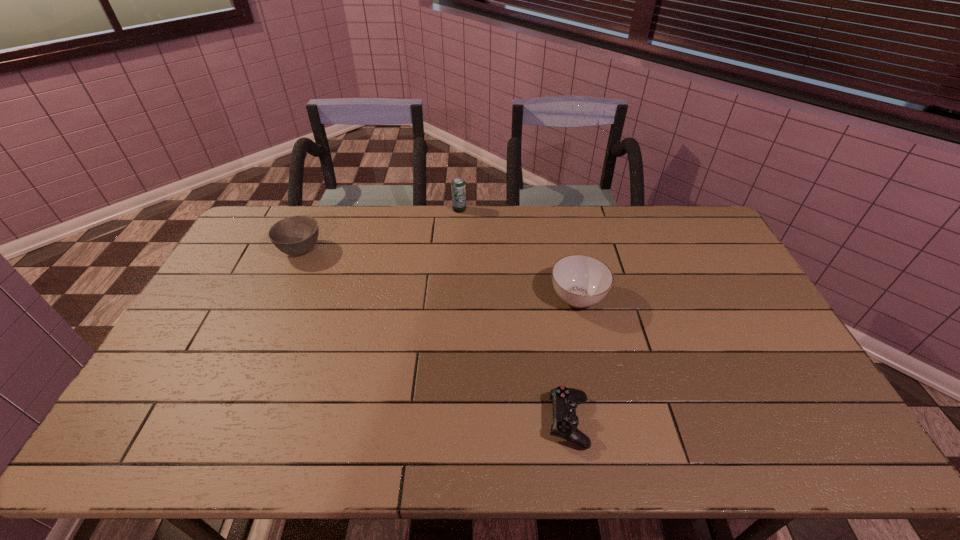
This screenshot has height=540, width=960. In order to click on the farthest object in this screenshot , I will do `click(458, 187)`.

This screenshot has width=960, height=540. I want to click on beer can, so click(x=458, y=187).

Where is `the third farthest object`? The height and width of the screenshot is (540, 960). the third farthest object is located at coordinates (581, 281).

You are a GUI agent. You are given a task and a screenshot of the screen. Output one action in this format:
    pyautogui.click(x=<x>, y=<y>)
    Task: Click on the third nearest object
    
    Given the screenshot: What is the action you would take?
    pyautogui.click(x=296, y=235)

Identify the location of the leftmost object. (296, 235).

At what (x,y) coordinates should I click in order to perform the action: click on control. Please return your answer as a coordinate pair (x, y). The height and width of the screenshot is (540, 960). Looking at the image, I should click on (565, 400).

I want to click on the nearest object, so click(x=565, y=400).

Locate an element on the screen. This screenshot has width=960, height=540. blank space located on the front of the farthest object is located at coordinates (x=458, y=226).

Identify the location of vacant space located 0.070m on the left of the second nearest object. The width and height of the screenshot is (960, 540). (526, 298).

The height and width of the screenshot is (540, 960). In order to click on vacant space situated on the left of the bowl in this screenshot , I will do `click(261, 250)`.